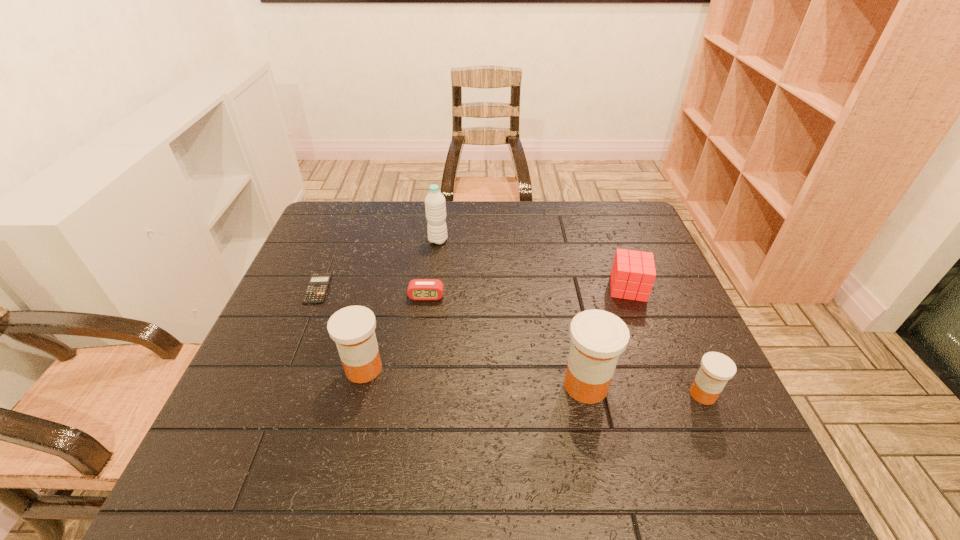
Where is `free space between the second medicine from left to right and the fifth shortest object`? The image size is (960, 540). free space between the second medicine from left to right and the fifth shortest object is located at coordinates (475, 377).

Identify the location of free spot between the farthest object and the alarm clock. Image resolution: width=960 pixels, height=540 pixels. (432, 268).

Identify the location of free space between the shortest object and the cube. Image resolution: width=960 pixels, height=540 pixels. 473,288.

Identify the location of free space between the shortest medicine and the sixth tallest object. This screenshot has width=960, height=540. click(x=564, y=345).

The height and width of the screenshot is (540, 960). Find the location of `vacant area that lies between the farthest object and the cube`. vacant area that lies between the farthest object and the cube is located at coordinates (533, 264).

The width and height of the screenshot is (960, 540). I want to click on empty space that is in between the fifth object from left to right and the alarm clock, so click(x=506, y=341).

What are the coordinates of `vacant area that lies between the rightmost medicine and the fifth object from left to right` in the screenshot? It's located at (x=644, y=390).

You are a GUI agent. You are given a task and a screenshot of the screen. Output one action in this format:
    pyautogui.click(x=<x>, y=<y>)
    Task: Click on the unoccupied position between the second medicine from right to left and the water bottle
    This screenshot has width=960, height=540.
    Given the screenshot: What is the action you would take?
    pyautogui.click(x=512, y=313)

Identify the location of free space between the sixth tallest object and the shortest medicine. (564, 345).

Point out which object is positioned as the second nearest to the shortest object. Please provide its 2D coordinates. Your answer should be formatted as a tuple, i.e. [(x, y)], where the tuple contains the x and y coordinates of a point satisfying the conditions above.

[(418, 289)]